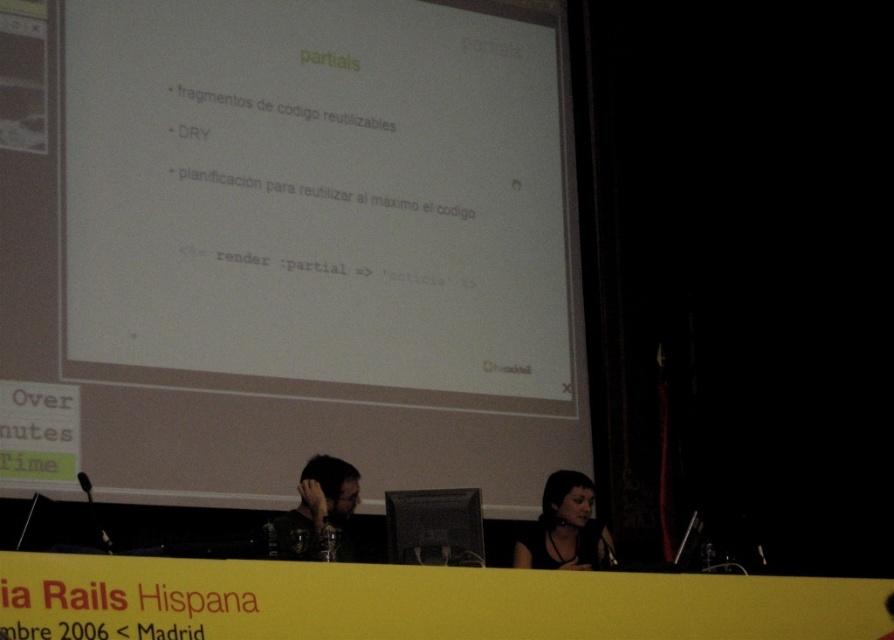
Question: Which object appears farthest from the camera in this image?

Choices:
 (A) matte black hair at center
 (B) white matte projection screen at center
 (C) black leather hair at center

Answer: (C)

Question: Which object is the farthest from the matte black hair at center?

Choices:
 (A) black leather hair at center
 (B) white matte projection screen at center

Answer: (B)

Question: Is black leather hair at center to the right of matte black hair at center from the viewer's perspective?

Choices:
 (A) no
 (B) yes

Answer: (B)

Question: Based on their relative distances, which object is farther from the matte black hair at center?

Choices:
 (A) white matte projection screen at center
 (B) black leather hair at center

Answer: (A)

Question: Is white matte projection screen at center behind matte black hair at center?

Choices:
 (A) yes
 (B) no

Answer: (B)

Question: Does white matte projection screen at center lie behind black leather hair at center?

Choices:
 (A) no
 (B) yes

Answer: (A)